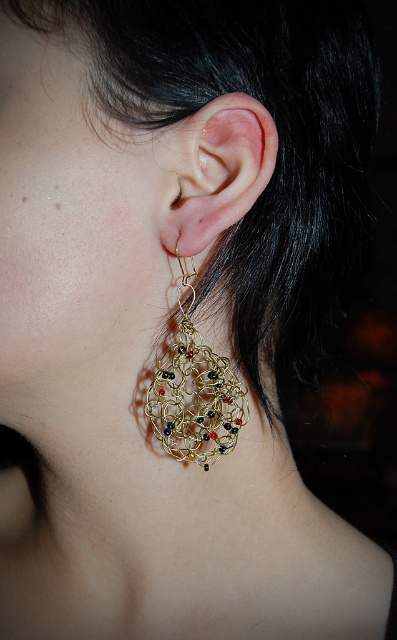
What do you see at coordinates (213, 170) in the screenshot? This screenshot has width=397, height=640. I see `matte gold earring at center` at bounding box center [213, 170].

Does matte gold earring at center have a larger size compared to gold wire mesh earring at lower left?

No, matte gold earring at center is not bigger than gold wire mesh earring at lower left.

This screenshot has height=640, width=397. I want to click on matte gold earring at center, so click(213, 170).

The image size is (397, 640). Find the location of `matte gold earring at center`. matte gold earring at center is located at coordinates pyautogui.click(x=213, y=170).